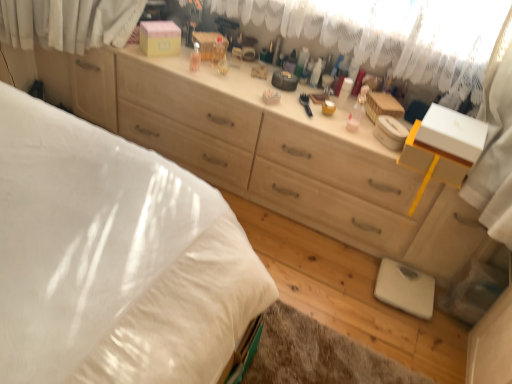
Question: Is transparent plastic bottle at center, arranged as the 3th toiletry when viewed from the right, looking in the opposite direction of white lace curtain at upper center?

Choices:
 (A) no
 (B) yes

Answer: (B)

Question: From the image's perspective, is transparent plastic bottle at center, which is counted as the 1th toiletry, starting from the left, on top of white lace curtain at upper center?

Choices:
 (A) no
 (B) yes

Answer: (A)

Question: Could you tell me if transparent plastic bottle at center, arranged as the 3th toiletry when viewed from the right, is turned towards white lace curtain at upper center?

Choices:
 (A) no
 (B) yes

Answer: (A)

Question: Considering the relative sizes of transparent plastic bottle at center, arranged as the 3th toiletry when viewed from the right, and white lace curtain at upper center in the image provided, is transparent plastic bottle at center, arranged as the 3th toiletry when viewed from the right, wider than white lace curtain at upper center?

Choices:
 (A) no
 (B) yes

Answer: (A)

Question: Is transparent plastic bottle at center, arranged as the 3th toiletry when viewed from the right, completely or partially outside of white lace curtain at upper center?

Choices:
 (A) yes
 (B) no

Answer: (A)

Question: Does transparent plastic bottle at center, arranged as the 3th toiletry when viewed from the right, have a lesser width compared to white lace curtain at upper center?

Choices:
 (A) no
 (B) yes

Answer: (B)

Question: Can you confirm if white lace curtain at upper center is shorter than white plastic container at center, placed as the 2th toiletry when sorted from left to right?

Choices:
 (A) yes
 (B) no

Answer: (B)

Question: Could you tell me if white lace curtain at upper center is turned towards white plastic container at center, placed as the 2th toiletry when sorted from left to right?

Choices:
 (A) yes
 (B) no

Answer: (A)

Question: From the image's perspective, is white lace curtain at upper center on top of white plastic container at center, arranged as the 2th toiletry when viewed from the right?

Choices:
 (A) no
 (B) yes

Answer: (B)

Question: Can you confirm if white lace curtain at upper center is taller than white plastic container at center, placed as the 2th toiletry when sorted from left to right?

Choices:
 (A) yes
 (B) no

Answer: (A)

Question: Is white lace curtain at upper center completely or partially outside of white plastic container at center, arranged as the 2th toiletry when viewed from the right?

Choices:
 (A) no
 (B) yes

Answer: (B)

Question: Does white lace curtain at upper center have a lesser width compared to white plastic container at center, placed as the 2th toiletry when sorted from left to right?

Choices:
 (A) no
 (B) yes

Answer: (A)

Question: Is white plastic container at center, placed as the 2th toiletry when sorted from left to right, wider than matte plastic container at center, placed as the first toiletry when sorted from right to left?

Choices:
 (A) no
 (B) yes

Answer: (A)